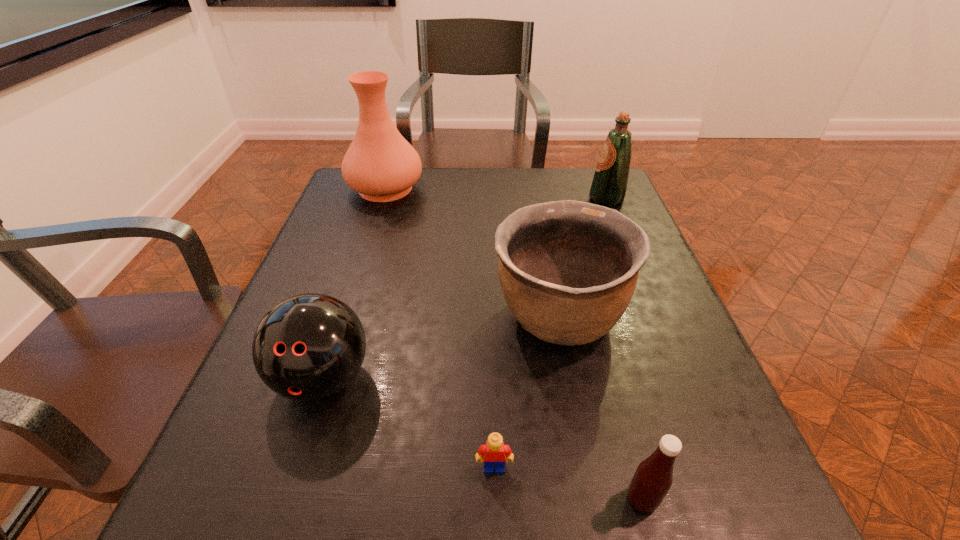
Locate an element on the screen. The height and width of the screenshot is (540, 960). the tallest object is located at coordinates (380, 164).

Locate an element on the screen. The width and height of the screenshot is (960, 540). the second tallest object is located at coordinates (609, 185).

The width and height of the screenshot is (960, 540). In order to click on the rightmost object in this screenshot , I will do `click(609, 185)`.

Where is `pottery`? This screenshot has width=960, height=540. pottery is located at coordinates (568, 269).

Identify the location of bowling ball. The width and height of the screenshot is (960, 540). (308, 347).

Locate an element on the screen. the nearest object is located at coordinates click(x=653, y=478).

The height and width of the screenshot is (540, 960). I want to click on the shortest object, so click(x=494, y=452).

Locate an element on the screen. The image size is (960, 540). the fifth farthest object is located at coordinates (494, 452).

Find the location of a particular element. Image resolution: width=960 pixels, height=540 pixels. vacant space situated 0.080m on the front of the tallest object is located at coordinates (373, 226).

This screenshot has width=960, height=540. I want to click on free spot located on the front-facing side of the fifth shortest object, so click(493, 199).